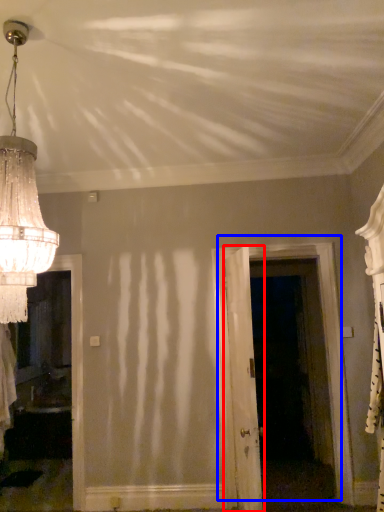
Question: Which of the following is the closest to the observer, door (highlighted by a red box) or door (highlighted by a blue box)?

Choices:
 (A) door
 (B) door

Answer: (A)